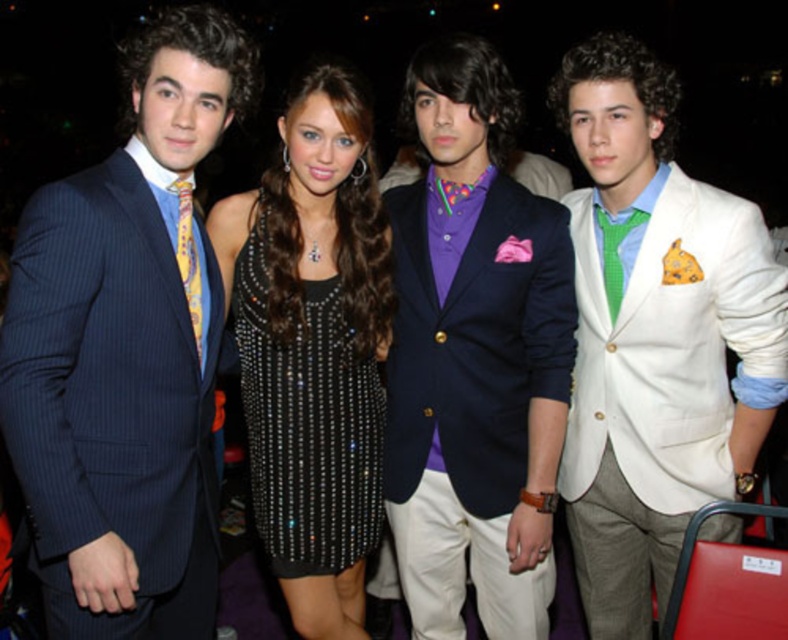
Question: Observing the image, what is the correct spatial positioning of green checkered tie at right in reference to yellowstriped fabrictie at left?

Choices:
 (A) below
 (B) above

Answer: (B)

Question: Is white textured blazer at center to the left of black sequined dress at center from the viewer's perspective?

Choices:
 (A) yes
 (B) no

Answer: (B)

Question: Which point appears farthest from the camera in this image?

Choices:
 (A) (181, 209)
 (B) (600, 525)
 (C) (545, 388)
 (D) (236, 77)

Answer: (B)

Question: Which of the following is the closest to the observer?

Choices:
 (A) (192, 262)
 (B) (284, 456)
 (C) (407, 577)

Answer: (A)

Question: Which of the following is the closest to the observer?

Choices:
 (A) (310, 417)
 (B) (601, 141)

Answer: (B)

Question: Does pinstriped suit at left appear on the left side of white textured blazer at center?

Choices:
 (A) yes
 (B) no

Answer: (A)